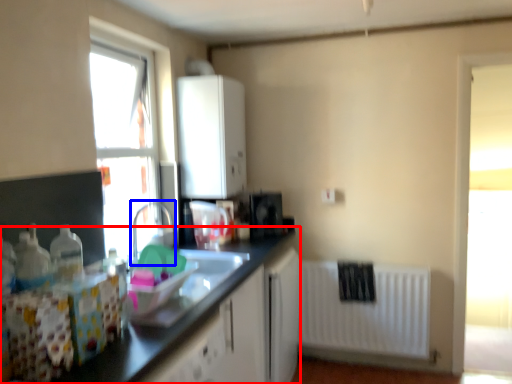
Question: Among these objects, which one is farthest to the camera, countertop (highlighted by a red box) or faucet (highlighted by a blue box)?

Choices:
 (A) countertop
 (B) faucet

Answer: (B)